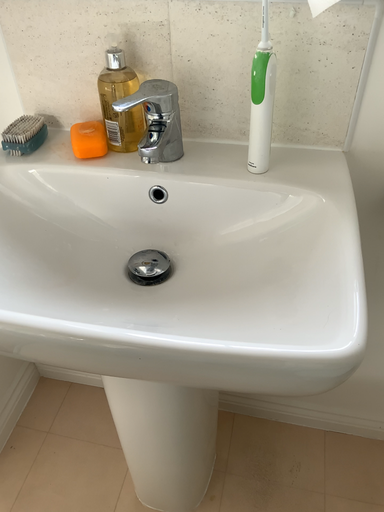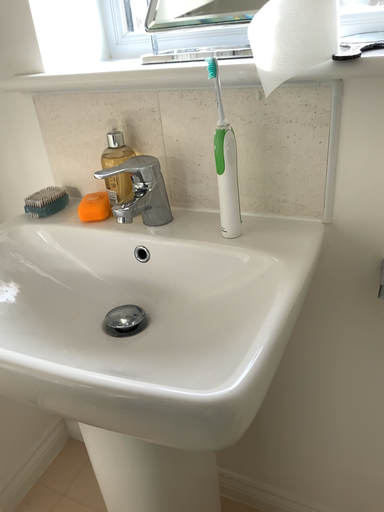
Question: Which way did the camera rotate in the video?

Choices:
 (A) rotated upward
 (B) rotated downward

Answer: (A)